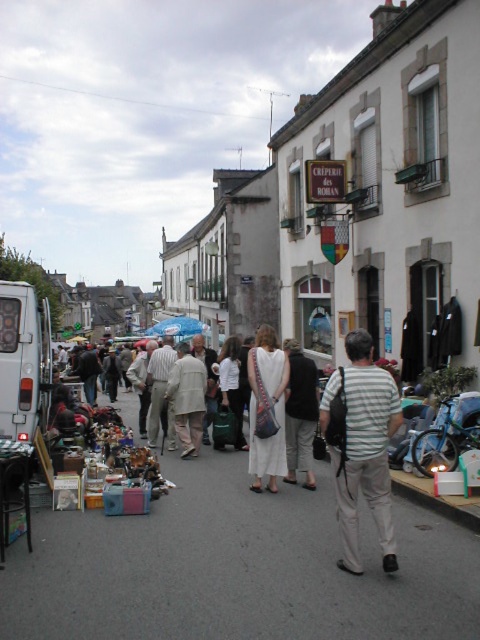
You are a delivery person with a package that is 1.8 meters wide. You need to pass between the matte white van at left and the white fabric dress at center. Is there enough space for your package to fit through?

The matte white van at left is narrower than the white fabric dress at center, so the space between them may vary. However, since the van is less wide than the dress, the total width available between them depends on their positions. Without exact distance measurements, it is uncertain if the 1.8 meter wide package can fit through. More information is needed to determine this.

You are a customer at the flea market and want to approach the white cotton dress at center displayed on the ground. However, there is a matte white van at left blocking your path. Can you walk around the van to reach the dress?

The matte white van at left is positioned over the white cotton dress at center, which means the van is directly above or in front of it, blocking access. Since the van is parked, you cannot move it, so you might need to find another path or ask for assistance to reach the white cotton dress at center.

You are a customer at the market and want to buy both the white cotton dress at center and the light beige fabric coat at center. If you first pick up the one that is on the left, which item will you have in your hands?

The light beige fabric coat at center is on the left side of the white cotton dress at center, so you will have the light beige fabric coat at center in your hands.